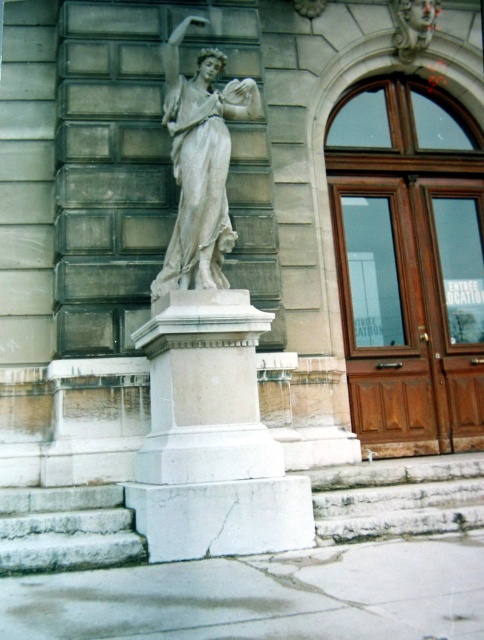
Between white marble pedestal at center and white marble statue at center, which one is positioned lower?

white marble pedestal at center is below.

Between point (185, 531) and point (184, 81), which one is positioned behind?

Point (184, 81)

Locate an element on the screen. The width and height of the screenshot is (484, 640). white marble pedestal at center is located at coordinates (211, 436).

Is white marble pedestal at center bigger than white marble stairs at lower center?

Yes, white marble pedestal at center is bigger than white marble stairs at lower center.

Can you confirm if white marble pedestal at center is positioned to the right of white marble stairs at lower center?

Incorrect, white marble pedestal at center is not on the right side of white marble stairs at lower center.

Which is behind, point (225, 504) or point (90, 499)?

The point (90, 499) is behind.

Find the location of a particular element. white marble pedestal at center is located at coordinates (211, 436).

Who is positioned more to the right, white marble stairs at lower center or white marble statue at center?

Positioned to the right is white marble stairs at lower center.

Who is higher up, white marble stairs at lower center or white marble statue at center?

Positioned higher is white marble statue at center.

In order to click on white marble stairs at lower center in this screenshot , I will do `click(397, 497)`.